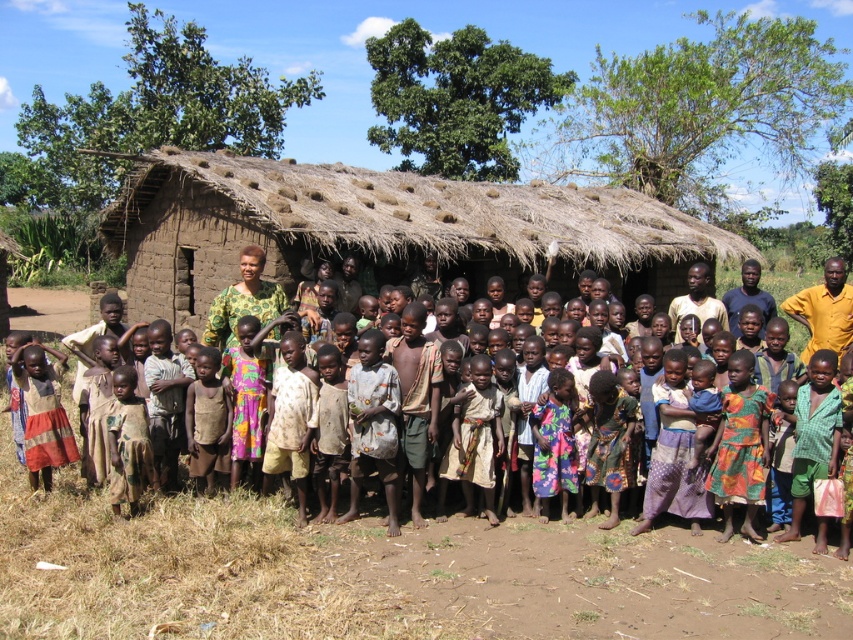
Question: Is brown thatch hut at center to the right of printed fabric dress at center from the viewer's perspective?

Choices:
 (A) yes
 (B) no

Answer: (B)

Question: Does brown thatch hut at center have a lesser width compared to printed fabric dress at center?

Choices:
 (A) yes
 (B) no

Answer: (B)

Question: Among these points, which one is nearest to the camera?

Choices:
 (A) (207, 307)
 (B) (39, 563)

Answer: (B)

Question: Does brown thatch hut at center lie in front of printed fabric dress at center?

Choices:
 (A) yes
 (B) no

Answer: (B)